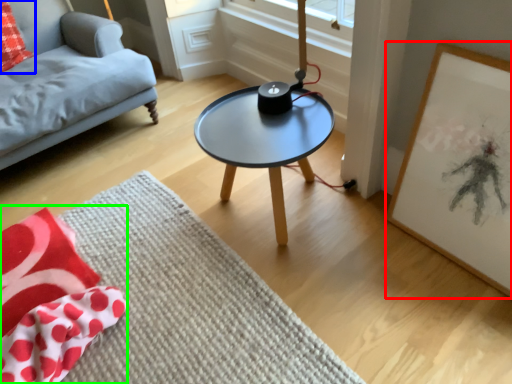
Question: Based on their relative distances, which object is nearer to picture frame (highlighted by a red box)? Choose from throw pillow (highlighted by a blue box) and blanket (highlighted by a green box).

Choices:
 (A) throw pillow
 (B) blanket

Answer: (B)